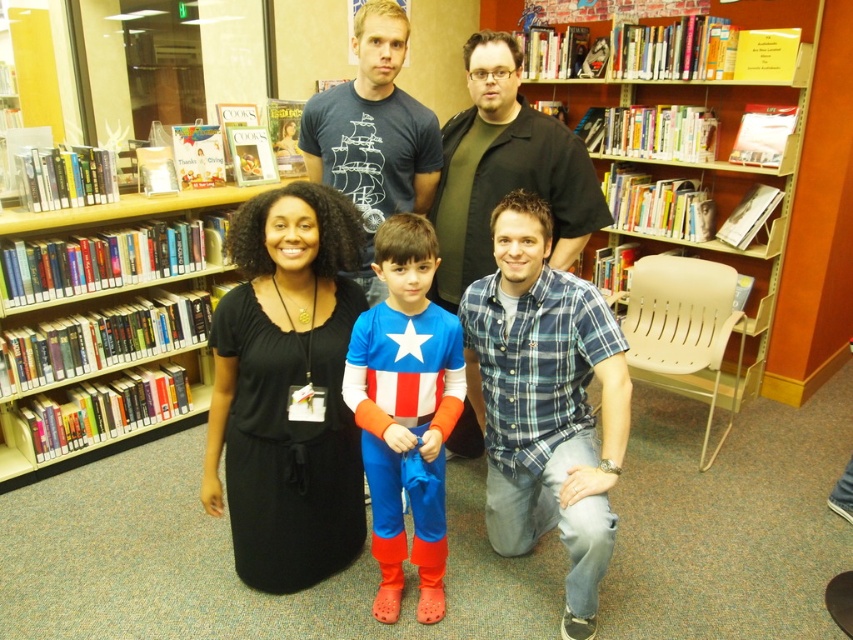
Question: Among these points, which one is farthest from the camera?

Choices:
 (A) pyautogui.click(x=474, y=436)
 (B) pyautogui.click(x=189, y=349)

Answer: (B)

Question: Which object is positioned closest to the black matte dress at center?

Choices:
 (A) matte black shirt at center
 (B) blue plaid shirt at lower center

Answer: (B)

Question: Can you confirm if black matte dress at center is positioned below blue plaid shirt at lower center?

Choices:
 (A) no
 (B) yes

Answer: (A)

Question: Is wooden bookshelf at center above shiny blue costume at center?

Choices:
 (A) no
 (B) yes

Answer: (B)

Question: Which of the following is the farthest from the observer?

Choices:
 (A) (502, 45)
 (B) (776, 225)
 (C) (491, 390)
 (D) (426, 504)

Answer: (B)

Question: Observing the image, what is the correct spatial positioning of black matte dress at center in reference to hardcover books at left?

Choices:
 (A) above
 (B) below

Answer: (A)